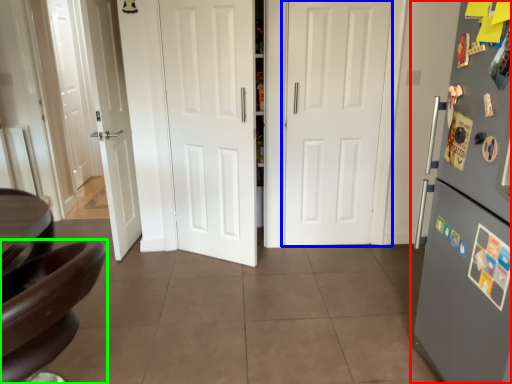
Question: Considering the real-world distances, which object is closest to refrigerator (highlighted by a red box)? door (highlighted by a blue box) or chair (highlighted by a green box).

Choices:
 (A) door
 (B) chair

Answer: (B)